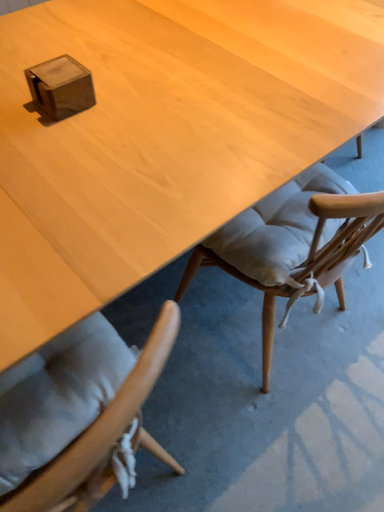
Where is `free space below light wood desk at center (from a real-world perspective)`? This screenshot has width=384, height=512. free space below light wood desk at center (from a real-world perspective) is located at coordinates (254, 322).